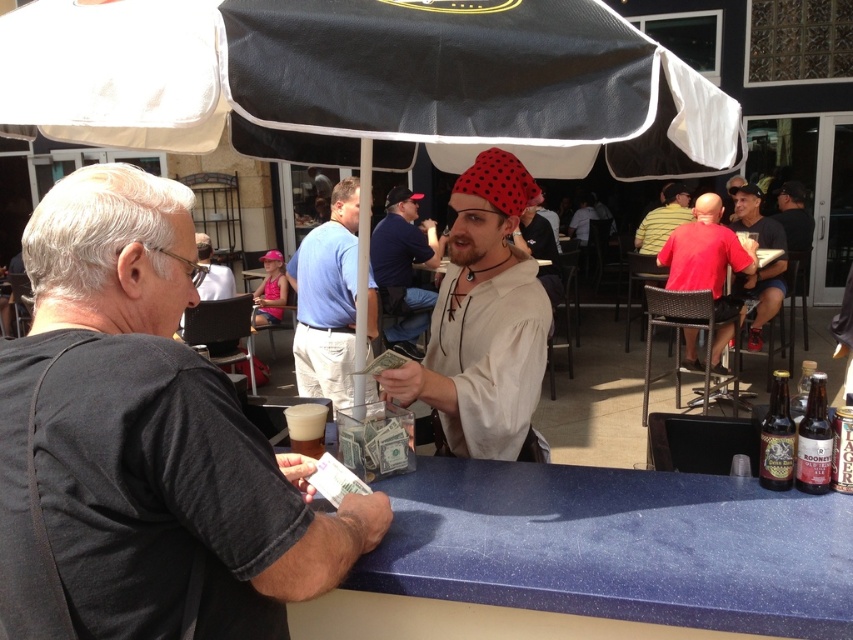
You are a delivery person trying to place a small package between the black fabric umbrella at upper center and the brown glass bottle at right. Can you fit the package there without moving either object?

The black fabric umbrella at upper center is wider than the brown glass bottle at right, so there is enough space between them to place the small package without moving either object.

You are standing at the counter in the bar and see two points marked on the floor. The first point is at position point (x=347, y=99) and the second point is at position point (x=816, y=404). Which point is closer to you?

Point (x=347, y=99) is in front of point (x=816, y=404), so it is closer to you.